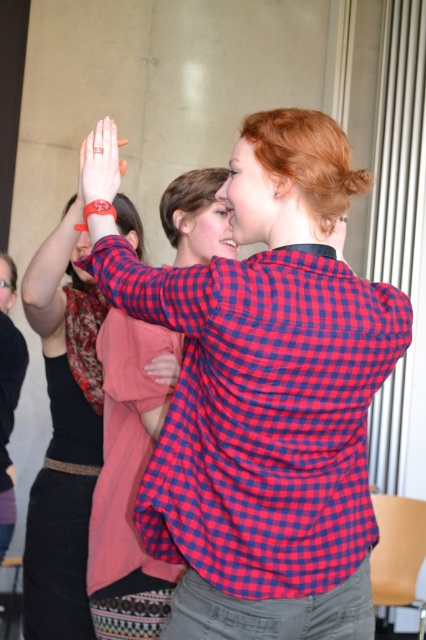
Question: Estimate the real-world distances between objects in this image. Which object is closer to the red checkered shirt at center?

Choices:
 (A) matte red wristband at upper left
 (B) black leather pants at lower left

Answer: (A)

Question: Which point appears closest to the camera in this image?

Choices:
 (A) (0, 458)
 (B) (170, 380)
 (C) (279, 138)

Answer: (C)

Question: Considering the relative positions of matte red wristband at upper left and matte pink hand at center in the image provided, where is matte red wristband at upper left located with respect to matte pink hand at center?

Choices:
 (A) above
 (B) below

Answer: (A)

Question: Based on their relative distances, which object is nearer to the red checkered shirt at center?

Choices:
 (A) matte red wristband at upper left
 (B) black leather pants at lower left
 (C) matte pink hand at center

Answer: (C)

Question: From the image, what is the correct spatial relationship of red checkered shirt at center in relation to matte red wristband at upper left?

Choices:
 (A) right
 (B) left

Answer: (A)

Question: Is red checkered shirt at center positioned behind black leather pants at lower left?

Choices:
 (A) no
 (B) yes

Answer: (A)